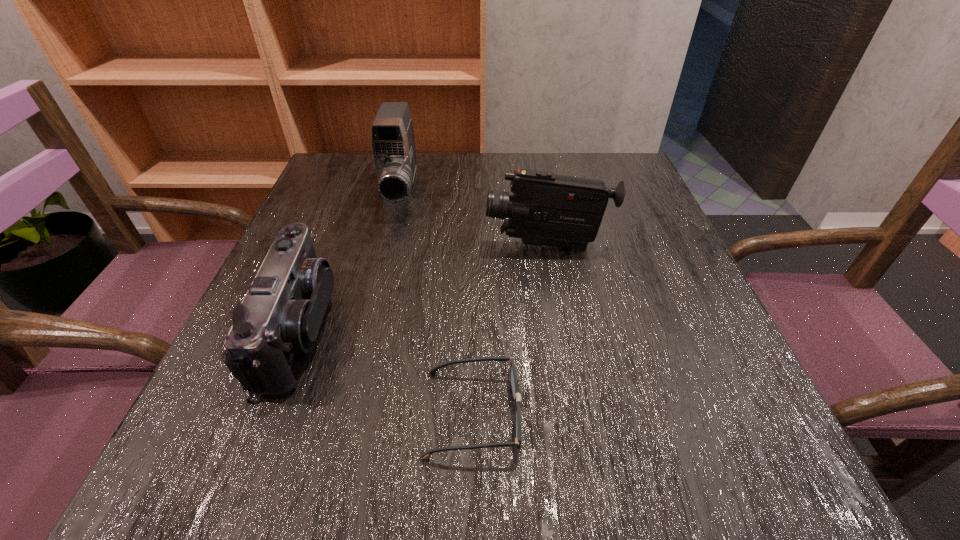
Where is `blank space at the far left corner`? The height and width of the screenshot is (540, 960). blank space at the far left corner is located at coordinates (369, 180).

This screenshot has height=540, width=960. Find the location of `vacant area at the near left corner`. vacant area at the near left corner is located at coordinates (265, 430).

Locate an element on the screen. free location at the far right corner is located at coordinates (612, 170).

The image size is (960, 540). In the image, there is a desktop. What are the coordinates of `vacant space at the near right corner` in the screenshot? It's located at (755, 447).

Find the location of a particular element. The height and width of the screenshot is (540, 960). empty space between the second farthest object and the third tallest object is located at coordinates (423, 287).

Locate an element on the screen. The height and width of the screenshot is (540, 960). vacant space in between the farthest object and the leftmost camcorder is located at coordinates (350, 261).

Find the location of a particular element. The height and width of the screenshot is (540, 960). free space that is in between the second object from left to right and the shortest object is located at coordinates (437, 303).

Where is `vacant space that is in between the shortest object and the second shortest object`? vacant space that is in between the shortest object and the second shortest object is located at coordinates (386, 371).

Locate an element on the screen. This screenshot has height=540, width=960. empty space that is in between the farthest object and the rightmost camcorder is located at coordinates 474,219.

Find the location of a particular element. free spot between the second camcorder from right to left and the second nearest camcorder is located at coordinates (474, 219).